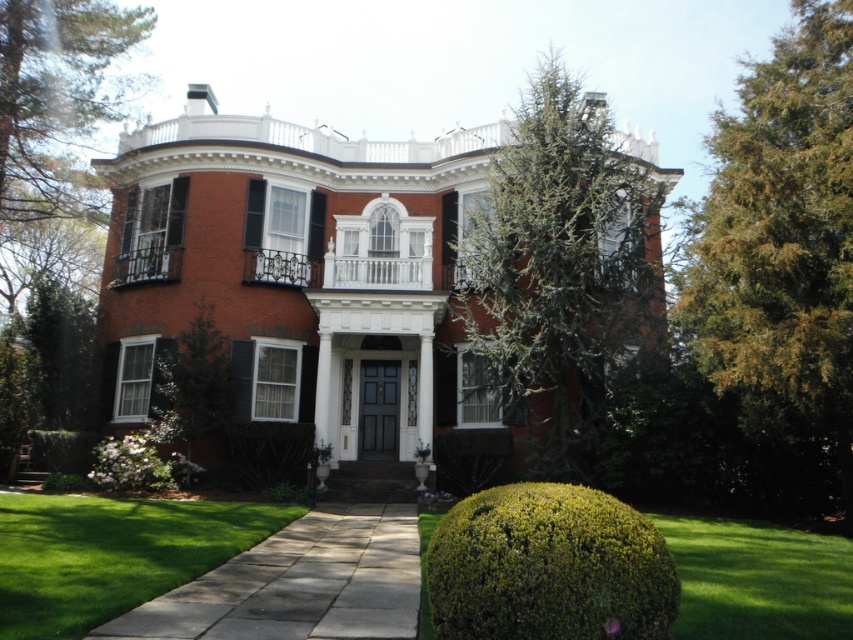
Question: Is green leafy tree at upper left closer to camera compared to green grass at lower left?

Choices:
 (A) no
 (B) yes

Answer: (A)

Question: Which object is closer to the camera taking this photo?

Choices:
 (A) green leafy tree at upper left
 (B) green grass at lower right
 (C) white wood shutter at center

Answer: (B)

Question: Can you confirm if green leafy bush at lower center is positioned above green leafy tree at upper left?

Choices:
 (A) no
 (B) yes

Answer: (A)

Question: Among these points, which one is nearest to the camera?

Choices:
 (A) (647, 593)
 (B) (640, 200)
 (C) (697, 637)

Answer: (A)

Question: Does brick house at center appear on the right side of green grass at lower right?

Choices:
 (A) yes
 (B) no

Answer: (B)

Question: Which point is farther from the camera taking this photo?

Choices:
 (A) (65, 129)
 (B) (840, 13)
 (C) (190, 296)
 (D) (648, 570)

Answer: (A)